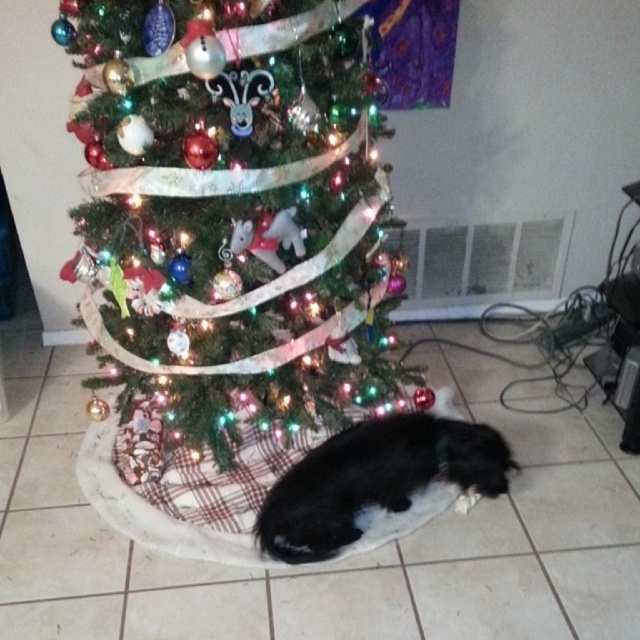
Does shiny green christmas tree at center come in front of black fur dog at lower center?

Yes, shiny green christmas tree at center is in front of black fur dog at lower center.

Where is `shiny green christmas tree at center`? shiny green christmas tree at center is located at coordinates (234, 214).